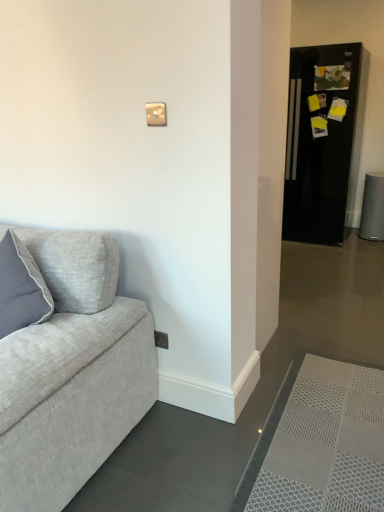
Question: Does matte white light switch at upper center have a larger size compared to black glossy refrigerator at right?

Choices:
 (A) no
 (B) yes

Answer: (A)

Question: From a real-world perspective, is matte white light switch at upper center physically above black glossy refrigerator at right?

Choices:
 (A) yes
 (B) no

Answer: (A)

Question: From the image's perspective, is matte white light switch at upper center over black glossy refrigerator at right?

Choices:
 (A) yes
 (B) no

Answer: (B)

Question: Could black glossy refrigerator at right be considered to be inside matte white light switch at upper center?

Choices:
 (A) yes
 (B) no

Answer: (B)

Question: Is there a large distance between matte white light switch at upper center and black glossy refrigerator at right?

Choices:
 (A) yes
 (B) no

Answer: (A)

Question: Considering the positions of matte white light switch at upper center and black glossy refrigerator at right in the image, is matte white light switch at upper center taller or shorter than black glossy refrigerator at right?

Choices:
 (A) tall
 (B) short

Answer: (B)

Question: From a real-world perspective, is matte white light switch at upper center above or below black glossy refrigerator at right?

Choices:
 (A) above
 (B) below

Answer: (A)

Question: In the image, is matte white light switch at upper center positioned in front of or behind black glossy refrigerator at right?

Choices:
 (A) behind
 (B) front

Answer: (B)

Question: Is matte white light switch at upper center wider or thinner than black glossy refrigerator at right?

Choices:
 (A) thin
 (B) wide

Answer: (A)

Question: In terms of width, does matte white light switch at upper center look wider or thinner when compared to white mesh doormat at lower right?

Choices:
 (A) thin
 (B) wide

Answer: (A)

Question: Which is correct: matte white light switch at upper center is inside white mesh doormat at lower right, or outside of it?

Choices:
 (A) inside
 (B) outside

Answer: (B)

Question: Considering their positions, is matte white light switch at upper center located in front of or behind white mesh doormat at lower right?

Choices:
 (A) front
 (B) behind

Answer: (B)

Question: Looking at the image, does matte white light switch at upper center seem bigger or smaller compared to white mesh doormat at lower right?

Choices:
 (A) big
 (B) small

Answer: (B)

Question: From a real-world perspective, is black glossy refrigerator at right positioned above or below matte white light switch at upper center?

Choices:
 (A) below
 (B) above

Answer: (A)

Question: Considering the positions of black glossy refrigerator at right and matte white light switch at upper center in the image, is black glossy refrigerator at right wider or thinner than matte white light switch at upper center?

Choices:
 (A) thin
 (B) wide

Answer: (B)